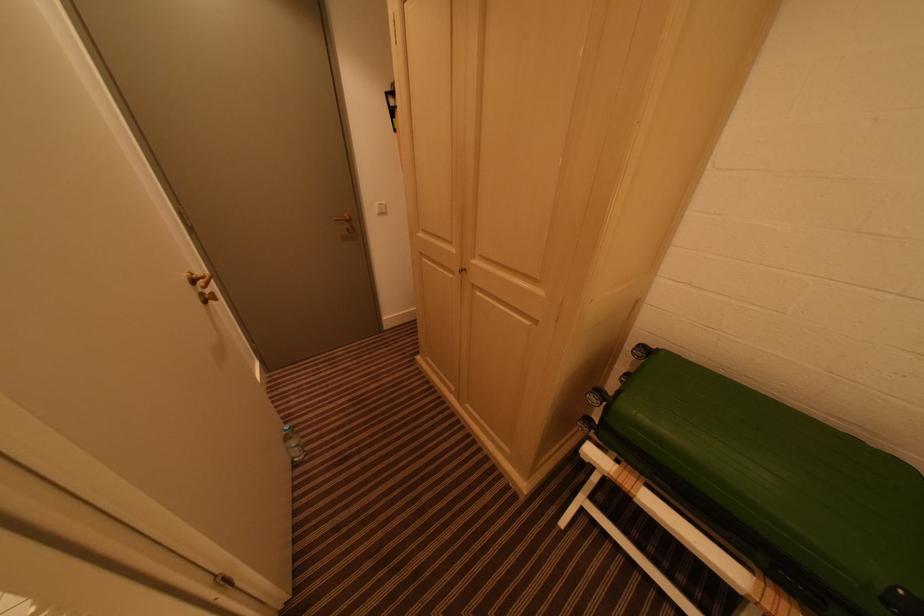
Image resolution: width=924 pixels, height=616 pixels. What are the coordinates of `plastic water bottle` in the screenshot? It's located at (293, 444).